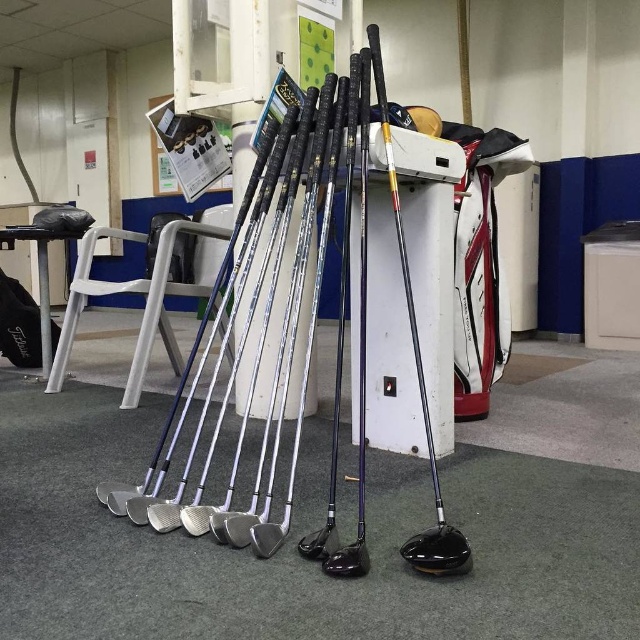
You are a maintenance worker in a golf facility and need to move a cleaning cart that is 6 feet wide through the space between the black rubber golf club at center and the black plastic stool at lower left. Can you fit the cart through that space?

The black rubber golf club at center is 5.85 feet from the black plastic stool at lower left, which is narrower than the 6 feet width of the cart. Therefore, the cart cannot fit through the space between them.

You are standing in the utility room looking at the golf clubs arranged on the floor. There are two points marked on the floor at coordinates point (362, 410) and point (45, 244). If you were to walk towards both points, which point would you reach first?

Point (362, 410) is closer to the camera than point (45, 244), so you would reach point (362, 410) first since it is nearer to your current position.